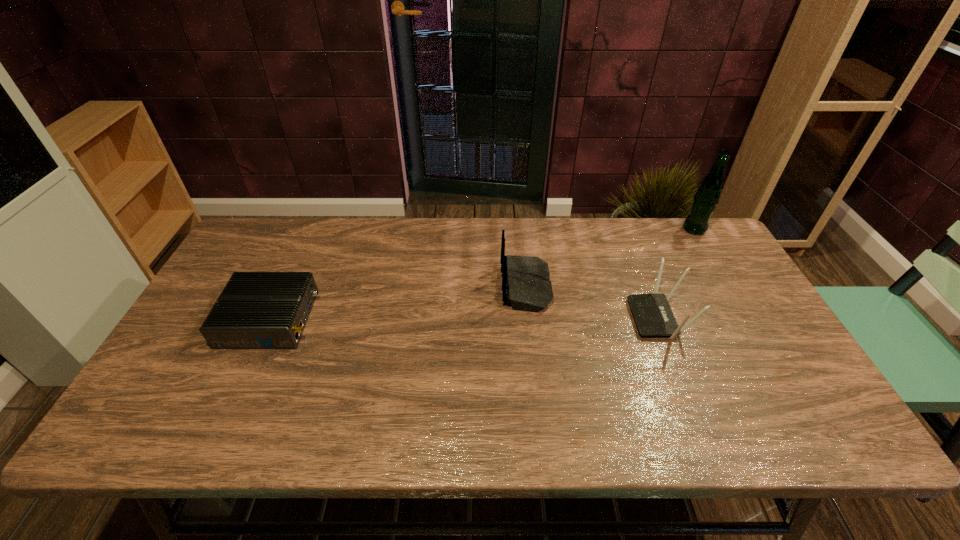
At what (x,y) coordinates should I click in order to perform the action: click on free space located 0.330m on the back of the second object from left to right. Please return your answer as a coordinate pair (x, y). Image resolution: width=960 pixels, height=540 pixels. Looking at the image, I should click on (389, 287).

Locate an element on the screen. vacant region located 0.240m on the front-facing side of the rightmost router is located at coordinates (544, 318).

Find the location of a particular element. This screenshot has height=540, width=960. vacant position located on the front-facing side of the rightmost router is located at coordinates (585, 318).

This screenshot has width=960, height=540. Find the location of `free space located on the front-facing side of the rightmost router`. free space located on the front-facing side of the rightmost router is located at coordinates (530, 318).

Identify the location of blank space located on the back panel of the leftmost router. (410, 319).

Identify the location of beer bottle located at the far edge. The image size is (960, 540). (707, 196).

You are a GUI agent. You are given a task and a screenshot of the screen. Output one action in this format:
    pyautogui.click(x=<x>, y=<y>)
    Task: Click on the router present at the far edge
    
    Given the screenshot: What is the action you would take?
    pyautogui.click(x=526, y=286)

At what (x,y) coordinates should I click in order to perform the action: click on object that is at the left edge. Please return your answer as a coordinate pair (x, y). The image size is (960, 540). Looking at the image, I should click on (256, 310).

What are the coordinates of `object situated at the right edge` in the screenshot? It's located at (707, 196).

This screenshot has height=540, width=960. What are the coordinates of `object that is at the far right corner` in the screenshot? It's located at (707, 196).